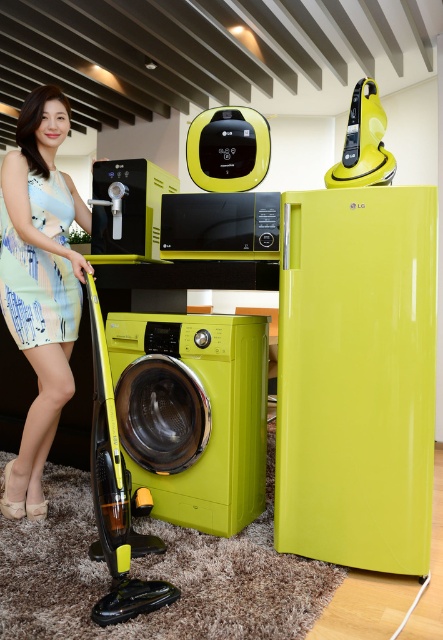
You are a fashion designer observing the image. You need to determine if two dresses can be displayed side by side on a 3 inch wide mannequin stand. The dresses are the matte blue dress at center and the printed fabric dress at left. Can both dresses fit on the stand?

The matte blue dress at center and the printed fabric dress at left are 2.55 inches apart from each other. Since the total width required is 2.55 inches and the mannequin stand is 3 inches wide, both dresses can fit comfortably on the stand.

Consider the image. You are organizing a fashion show and need to determine which dress requires a wider runway. Based on the image, which dress between the matte blue dress at center and the printed fabric dress at left should have a wider runway?

The matte blue dress at center requires a wider runway because its width is larger than the printed fabric dress at left.